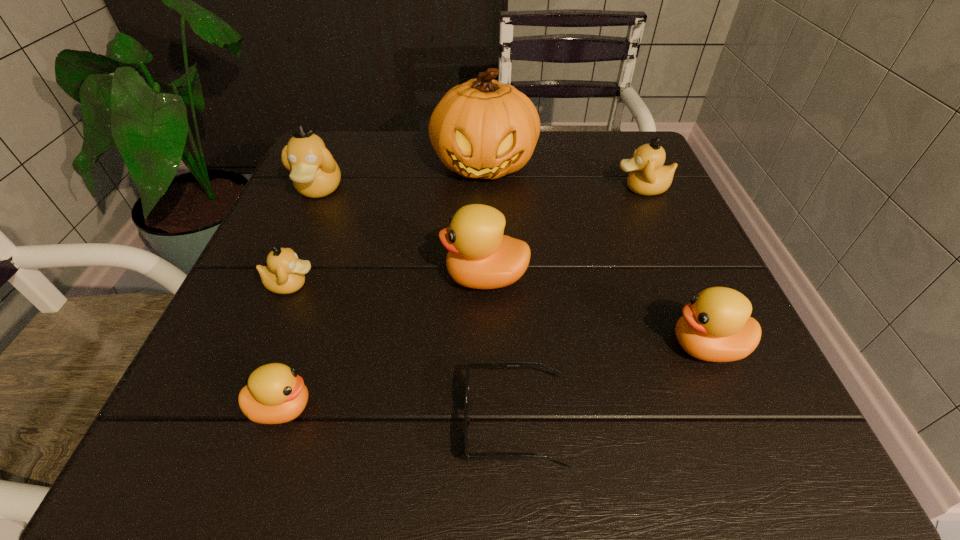
Image resolution: width=960 pixels, height=540 pixels. What are the coordinates of `the shortest object` in the screenshot? It's located at (470, 364).

Where is `black sunglasses`? black sunglasses is located at coordinates (470, 364).

The width and height of the screenshot is (960, 540). I want to click on free space located 0.210m on the front face of the pumpkin, so (486, 264).

Where is `free space located 0.090m on the face of the biggest tan duckling`? This screenshot has height=540, width=960. free space located 0.090m on the face of the biggest tan duckling is located at coordinates (298, 239).

The height and width of the screenshot is (540, 960). I want to click on free space located 0.340m on the face of the second yellow duckling from left to right, so click(x=249, y=277).

The width and height of the screenshot is (960, 540). I want to click on vacant region located on the face of the second yellow duckling from left to right, so [x=374, y=277].

The image size is (960, 540). I want to click on free space located 0.330m on the face of the second yellow duckling from left to right, so click(x=254, y=277).

Identify the location of vacant space situated 0.070m on the face of the rightmost tan duckling. (582, 188).

Identify the location of vacant space situated on the face of the rightmost tan duckling. This screenshot has height=540, width=960. (522, 188).

This screenshot has height=540, width=960. Identify the location of vacant space located on the face of the rightmost tan duckling. (486, 188).